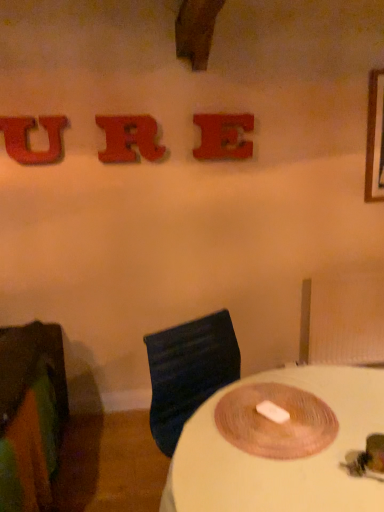
Question: Can you confirm if rubberized red letter r at upper center, which appears as the 2th alphabet when viewed from the right, is taller than matte red letter e at upper center, marked as the 1th alphabet in a right-to-left arrangement?

Choices:
 (A) yes
 (B) no

Answer: (A)

Question: Is rubberized red letter r at upper center, which appears as the 2th alphabet when viewed from the right, looking in the opposite direction of matte red letter e at upper center, marked as the 1th alphabet in a right-to-left arrangement?

Choices:
 (A) yes
 (B) no

Answer: (B)

Question: From a real-world perspective, is rubberized red letter r at upper center, which is counted as the 2th alphabet, starting from the left, over matte red letter e at upper center, marked as the 1th alphabet in a right-to-left arrangement?

Choices:
 (A) no
 (B) yes

Answer: (B)

Question: From a real-world perspective, is rubberized red letter r at upper center, which is counted as the 2th alphabet, starting from the left, located beneath matte red letter e at upper center, the third alphabet from the left?

Choices:
 (A) yes
 (B) no

Answer: (B)

Question: Is rubberized red letter r at upper center, which is counted as the 2th alphabet, starting from the left, at the left side of matte red letter e at upper center, the third alphabet from the left?

Choices:
 (A) yes
 (B) no

Answer: (A)

Question: In terms of width, does green fabric chair at left look wider or thinner when compared to white matte table at center?

Choices:
 (A) thin
 (B) wide

Answer: (B)

Question: Is green fabric chair at left in front of or behind white matte table at center in the image?

Choices:
 (A) front
 (B) behind

Answer: (B)

Question: From the image's perspective, is green fabric chair at left located above or below white matte table at center?

Choices:
 (A) above
 (B) below

Answer: (A)

Question: Based on their sizes in the image, would you say green fabric chair at left is bigger or smaller than white matte table at center?

Choices:
 (A) small
 (B) big

Answer: (A)

Question: Looking at the image, does matte red letter e at upper center, marked as the 1th alphabet in a right-to-left arrangement, seem bigger or smaller compared to white matte table at center?

Choices:
 (A) big
 (B) small

Answer: (B)

Question: In terms of height, does matte red letter e at upper center, the third alphabet from the left, look taller or shorter compared to white matte table at center?

Choices:
 (A) short
 (B) tall

Answer: (A)

Question: Is matte red letter e at upper center, the third alphabet from the left, spatially inside white matte table at center, or outside of it?

Choices:
 (A) inside
 (B) outside

Answer: (B)

Question: In terms of width, does matte red letter e at upper center, the third alphabet from the left, look wider or thinner when compared to white matte table at center?

Choices:
 (A) thin
 (B) wide

Answer: (A)

Question: From a real-world perspective, is rubberized red letter r at upper center, which appears as the 2th alphabet when viewed from the right, physically located above or below white matte table at center?

Choices:
 (A) below
 (B) above

Answer: (B)

Question: Is rubberized red letter r at upper center, which appears as the 2th alphabet when viewed from the right, in front of or behind white matte table at center in the image?

Choices:
 (A) behind
 (B) front

Answer: (A)